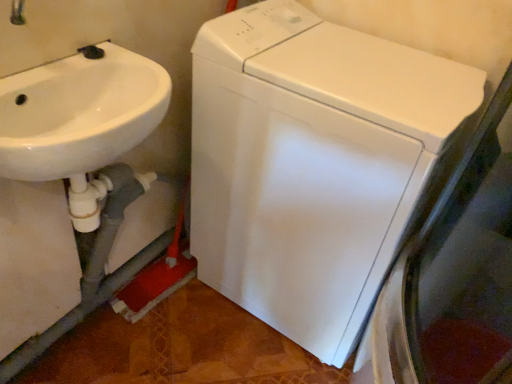
Locate an element on the screen. free region under white glossy sink at left (from a real-world perspective) is located at coordinates tap(118, 356).